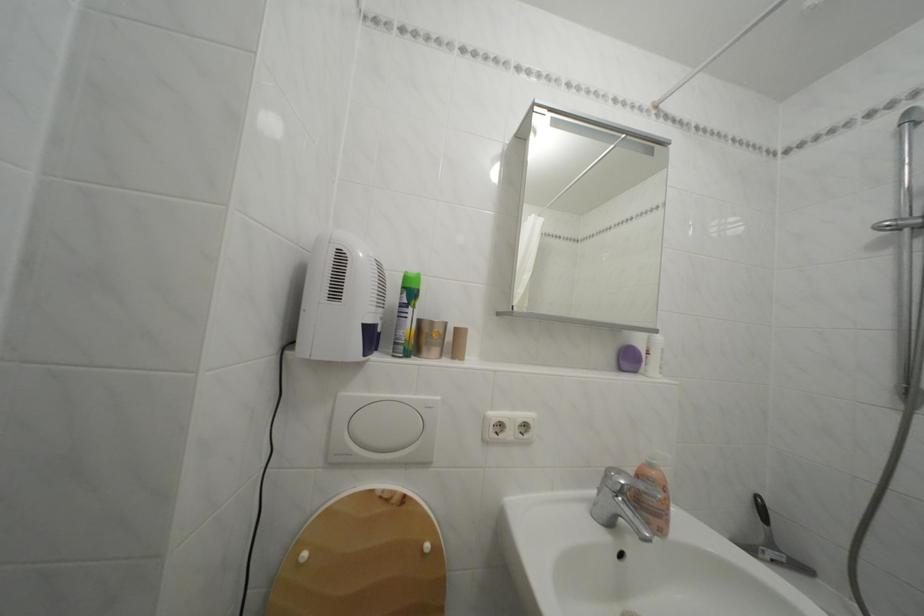
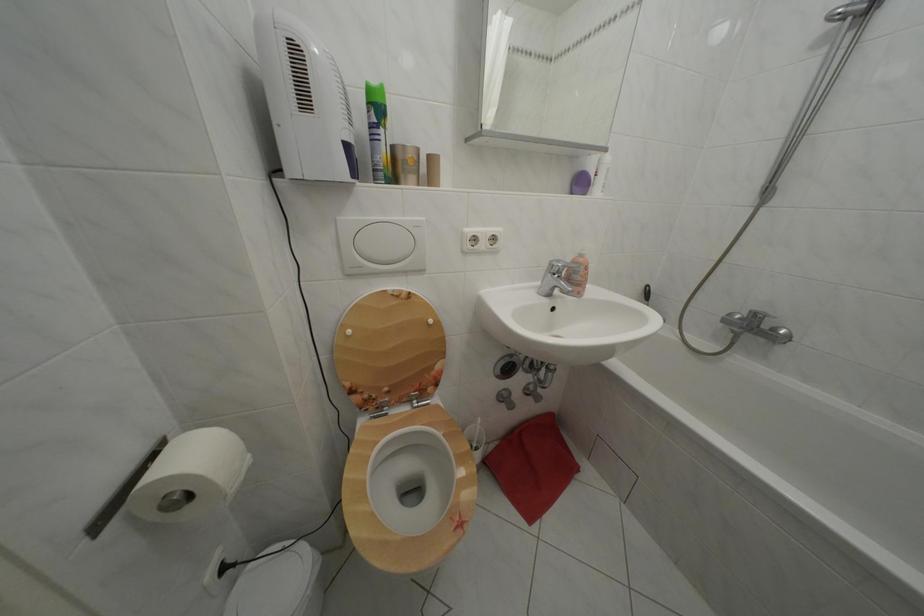
In the second image, find the point that corresponds to [313,561] in the first image.

(358, 338)